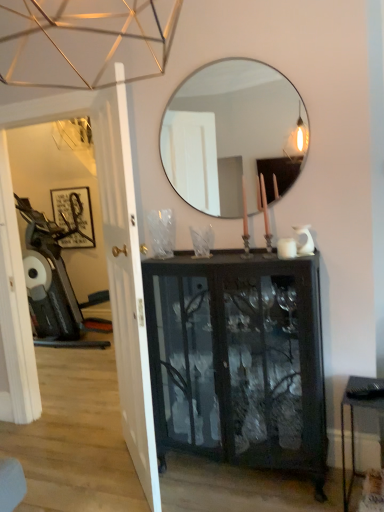
Identify the location of vacant space underneath black glass cabinet at center (from a real-world perspective). This screenshot has width=384, height=512. (233, 477).